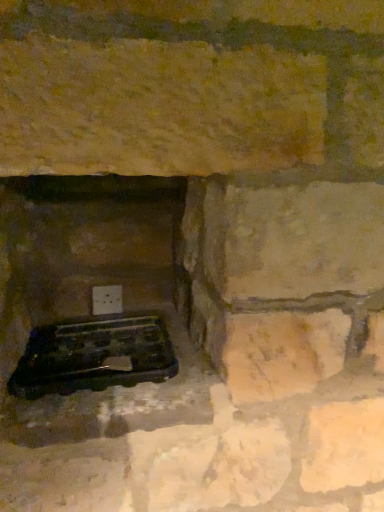
Question: Considering the positions of black plastic grill at lower left and white plastic electric outlet at lower center in the image, is black plastic grill at lower left wider or thinner than white plastic electric outlet at lower center?

Choices:
 (A) wide
 (B) thin

Answer: (A)

Question: From their relative heights in the image, would you say black plastic grill at lower left is taller or shorter than white plastic electric outlet at lower center?

Choices:
 (A) tall
 (B) short

Answer: (B)

Question: Which object is the closest to the black plastic tray at lower left?

Choices:
 (A) white plastic electric outlet at lower center
 (B) black plastic grill at lower left

Answer: (B)

Question: Which is nearer to the white plastic electric outlet at lower center?

Choices:
 (A) black plastic grill at lower left
 (B) black plastic tray at lower left

Answer: (B)